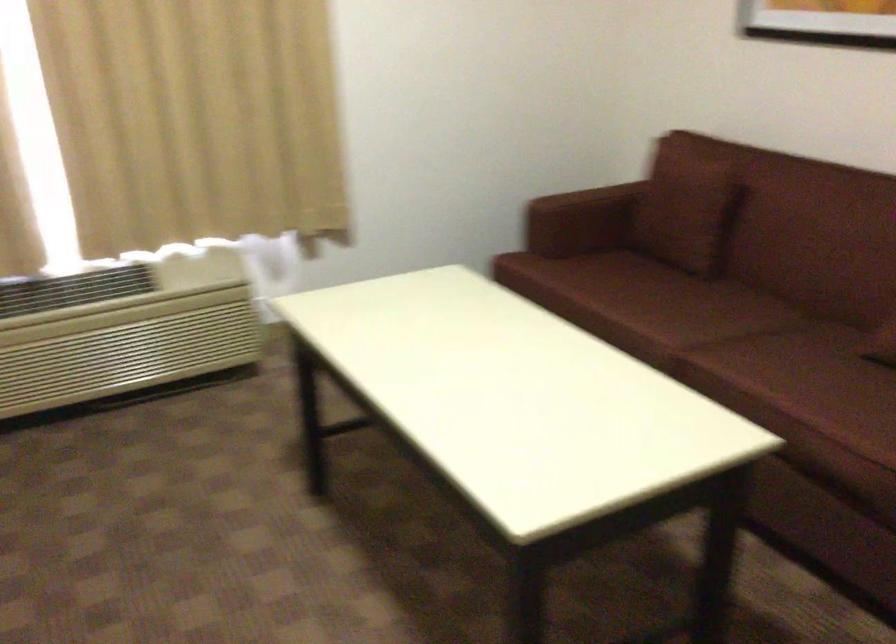
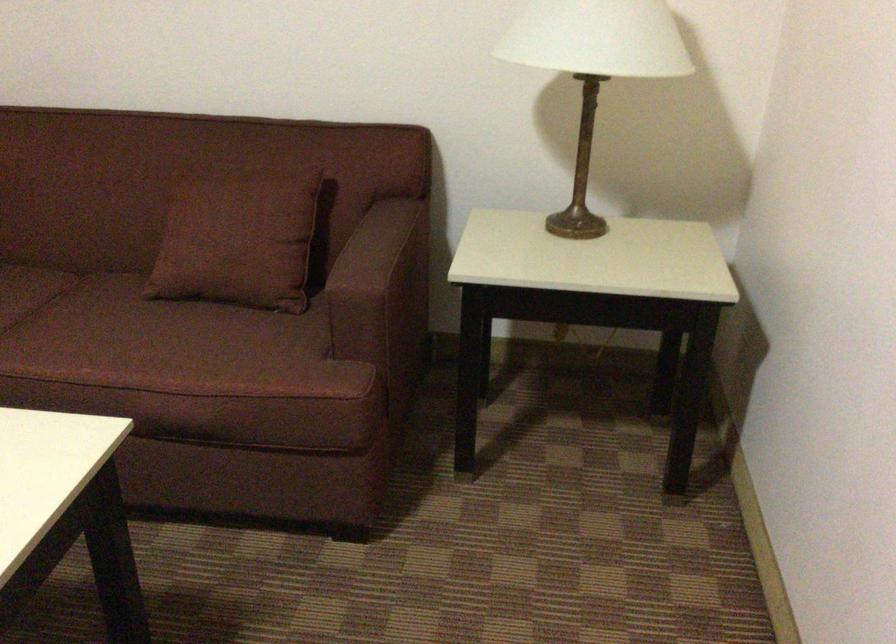
Locate, in the second image, the point that corresponds to [820,377] in the first image.

(135, 339)